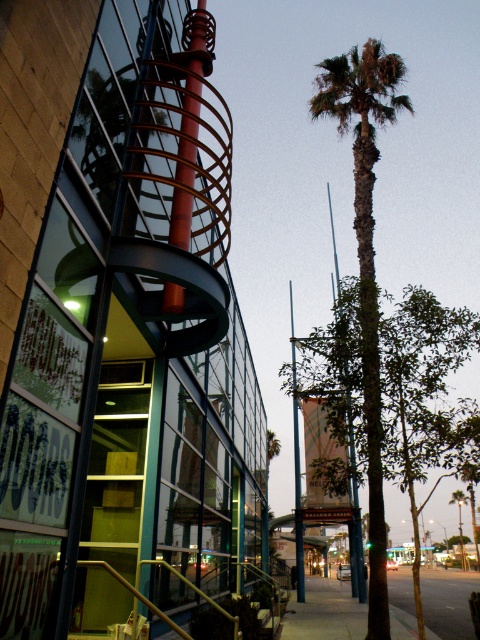
Can you confirm if green leafy palm tree at center is smaller than gray concrete sidewalk at lower center?

Indeed, green leafy palm tree at center has a smaller size compared to gray concrete sidewalk at lower center.

Who is positioned more to the left, green leafy palm tree at center or gray concrete sidewalk at lower center?

green leafy palm tree at center is more to the left.

You are a GUI agent. You are given a task and a screenshot of the screen. Output one action in this format:
    pyautogui.click(x=<x>, y=<y>)
    Task: Click on the green leafy palm tree at center
    The image size is (480, 640).
    Given the screenshot: What is the action you would take?
    pyautogui.click(x=365, y=259)

Between green leafy tree at center and green leafy palm tree at center, which one has less height?

green leafy tree at center is shorter.

Which is more to the left, green leafy tree at center or green leafy palm tree at center?

green leafy tree at center

Which is in front, point (380, 349) or point (360, 180)?

Point (380, 349) is in front.

The height and width of the screenshot is (640, 480). Find the location of `green leafy tree at center`. green leafy tree at center is located at coordinates (394, 403).

Between point (367, 433) and point (307, 616), which one is positioned behind?

The point (307, 616) is more distant.

Is green leafy tree at center positioned before gray concrete sidewalk at lower center?

That is True.

Describe the element at coordinates (394, 403) in the screenshot. Image resolution: width=480 pixels, height=640 pixels. I see `green leafy tree at center` at that location.

This screenshot has height=640, width=480. In order to click on green leafy tree at center in this screenshot , I will do `click(394, 403)`.